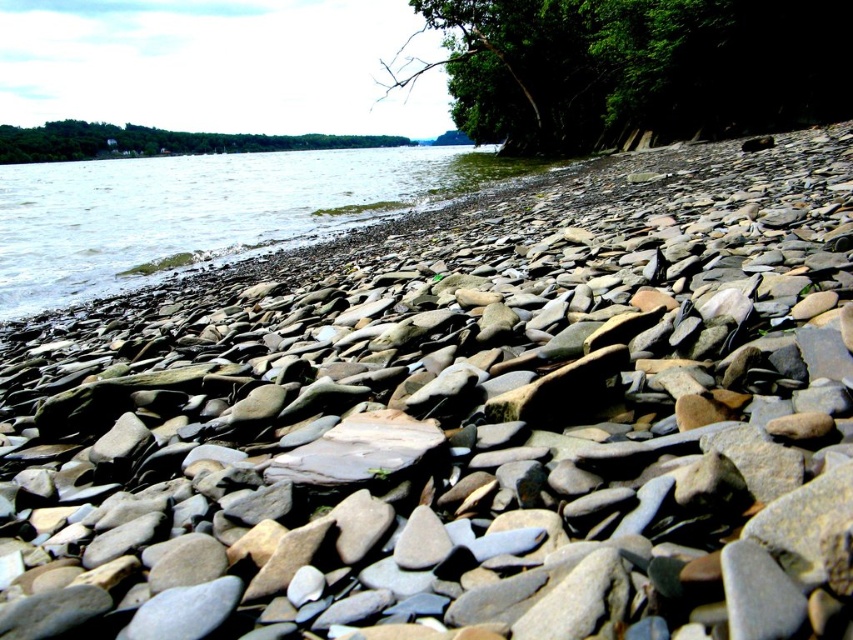
You are standing at the riverside and want to take a photo of the green leafy tree at upper right and the clear water at lower left. Which object will appear taller in the photo?

The green leafy tree at upper right will appear taller in the photo because it has a greater height compared to the clear water at lower left.

You are standing at the riverside and want to take a photo of the green leafy tree at upper right. The camera you have can focus on objects up to 20 meters away. Will the tree be in focus?

The green leafy tree at upper right is 18.88 meters away from camera, which is within the camera focus range of 20 meters. Therefore, the tree will be in focus.

You are standing on the riverside and want to take a photo of the clear water at lower left and the green leafy tree at upper center. Which object is closer to the camera?

The clear water at lower left is closer to the camera because it is not as tall as the green leafy tree at upper center, indicating it is in the foreground.